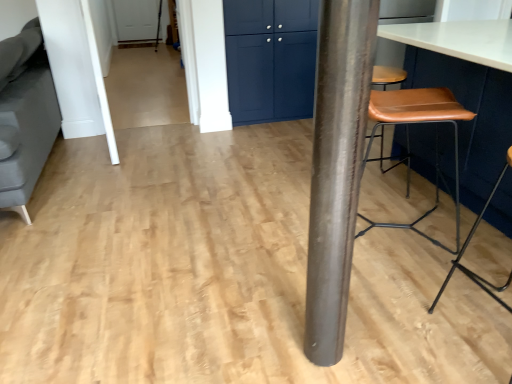
The image size is (512, 384). I want to click on vacant space underneath matte blue cabinet at upper center (from a real-world perspective), so click(277, 117).